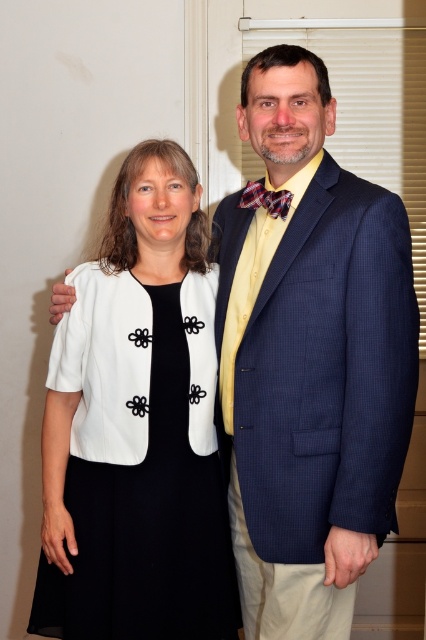
You are organizing a charity event and need to decide which item to place in a donation box. The navy blue textured suit at right and the plaid fabric bow tie at center are both available. Which item takes up more space in the box?

The navy blue textured suit at right is larger in size than the plaid fabric bow tie at center, so it takes up more space in the donation box.

You are a photographer setting up for a group photo. You want to ensure that both the white matte dress at center and the navy blue textured suit at right are clearly visible in the frame. Based on their positions, which clothing item is closer to the camera?

The white matte dress at center is closer to the camera because the navy blue textured suit at right is behind it.

You are a photographer setting up for a group photo. You have two subjects wearing the white matte dress at center and the navy blue textured suit at right. Based on their clothing sizes, which subject should you position closer to the camera to balance the visual weight of the composition?

The white matte dress at center is bigger than the navy blue textured suit at right, so you should position the person wearing the navy blue textured suit at right closer to the camera to balance the visual weight.